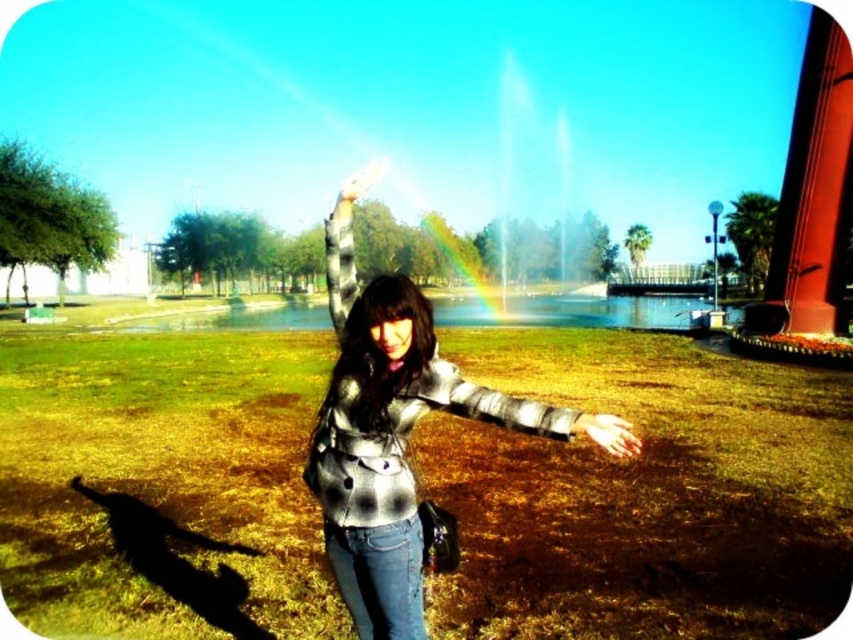
Question: Is plaid fabric shirt at center thinner than matte black hand at center?

Choices:
 (A) yes
 (B) no

Answer: (A)

Question: Which object is farther from the camera taking this photo?

Choices:
 (A) matte black hand at center
 (B) denim jeans at center
 (C) smooth skin hand at lower center

Answer: (A)

Question: Which object appears farthest from the camera in this image?

Choices:
 (A) plaid fabric shirt at center
 (B) smooth skin hand at lower center

Answer: (A)

Question: Estimate the real-world distances between objects in this image. Which object is closer to the plaid fabric shirt at center?

Choices:
 (A) plaid fabric arm at center
 (B) striped fabric arm at center
 (C) denim jeans at center
 (D) matte black hand at center

Answer: (A)

Question: Is plaid fabric shirt at center further to camera compared to matte black hand at center?

Choices:
 (A) yes
 (B) no

Answer: (B)

Question: Does striped fabric arm at center have a lesser width compared to matte black hand at center?

Choices:
 (A) yes
 (B) no

Answer: (A)